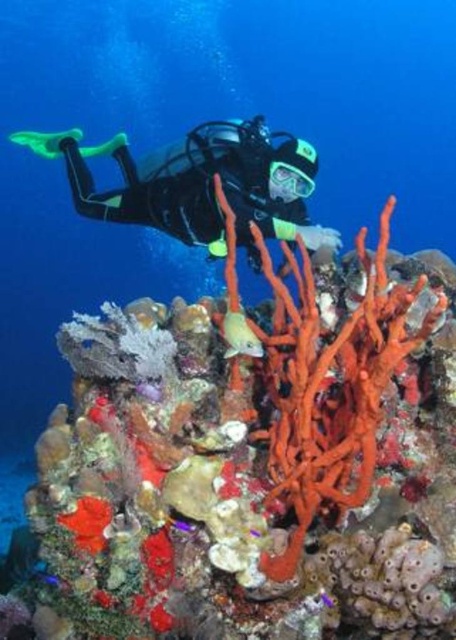
From the picture: You are a scuba diver wearing a 5.5 feet long diving knife attached to your leg. You want to reach the orange sponge at center without moving your body. Can you do it with your hand stretched out?

The distance between you and the orange sponge at center is 6.44 feet, which is longer than the 5.5 feet length of your diving knife. Therefore, you cannot reach the orange sponge at center with your hand and knife.

You are a marine biologist observing the underwater scene. You notice the orange sponge at center and the black matte scuba diver at upper center. Which object has a smaller width?

The orange sponge at center has a smaller width than the black matte scuba diver at upper center.